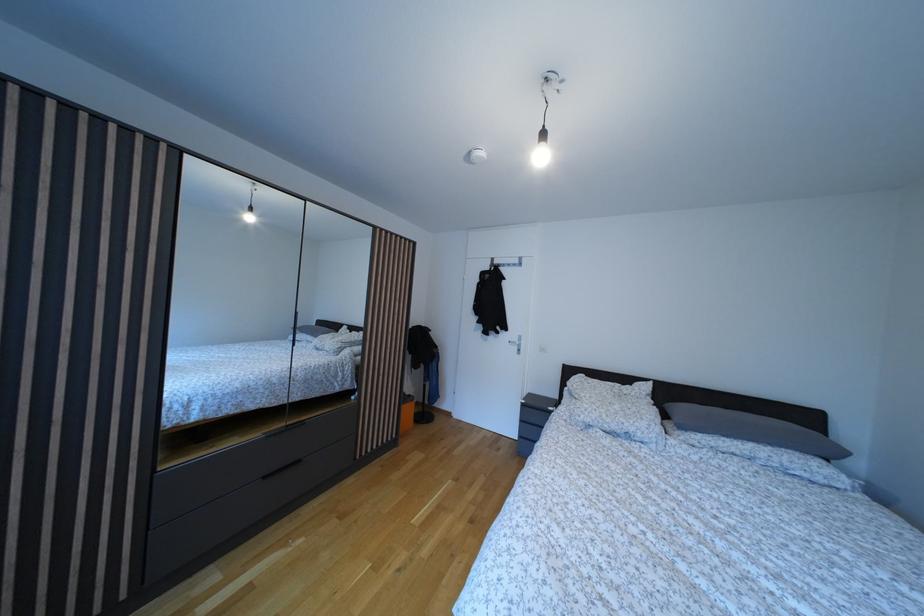
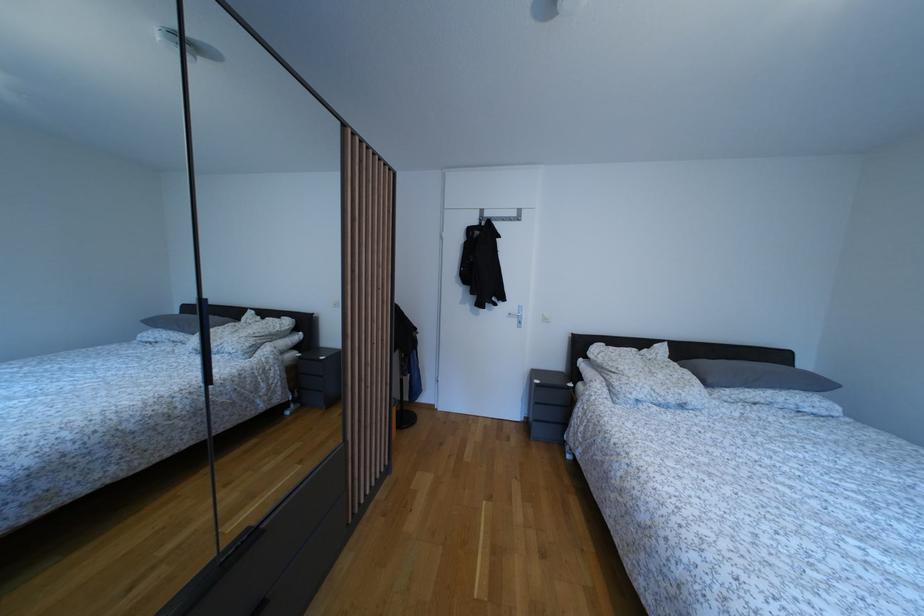
In a continuous first-person perspective shot, in which direction is the camera moving?

The cameraman moved toward left, forward.